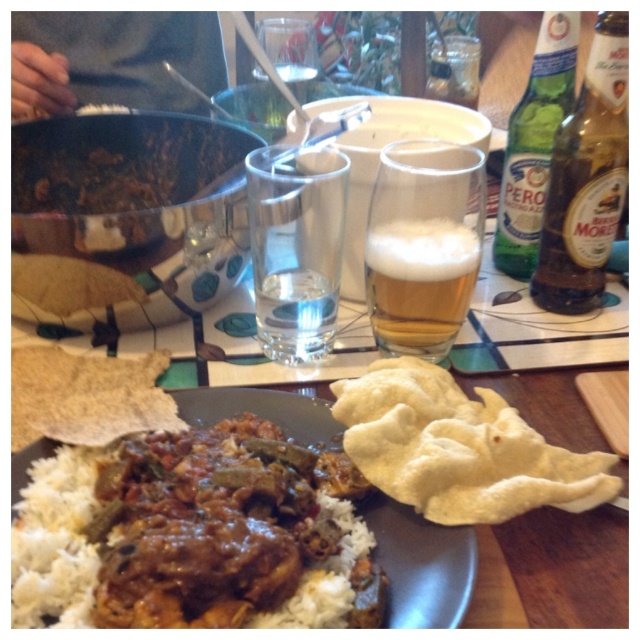
Which is behind, point (522, 109) or point (317, 273)?

Point (522, 109)

This screenshot has height=640, width=640. What do you see at coordinates (534, 141) in the screenshot?
I see `green glass bottle at upper right` at bounding box center [534, 141].

Locate an element on the screen. The width and height of the screenshot is (640, 640). green glass bottle at upper right is located at coordinates (534, 141).

Is white matte rice at lower left taller than clear glass water at center?

Correct, white matte rice at lower left is much taller as clear glass water at center.

Between white matte rice at lower left and clear glass water at center, which one appears on the left side from the viewer's perspective?

white matte rice at lower left is more to the left.

What do you see at coordinates (195, 532) in the screenshot? This screenshot has width=640, height=640. I see `white matte rice at lower left` at bounding box center [195, 532].

Where is `white matte rice at lower left`? white matte rice at lower left is located at coordinates (195, 532).

Based on the photo, is white fluffy flatbread at lower right behind brown glass bottle at upper right?

That is False.

Between point (433, 518) and point (570, 304), which one is positioned behind?

The point (570, 304) is more distant.

Find the location of a particular element. white fluffy flatbread at lower right is located at coordinates (458, 449).